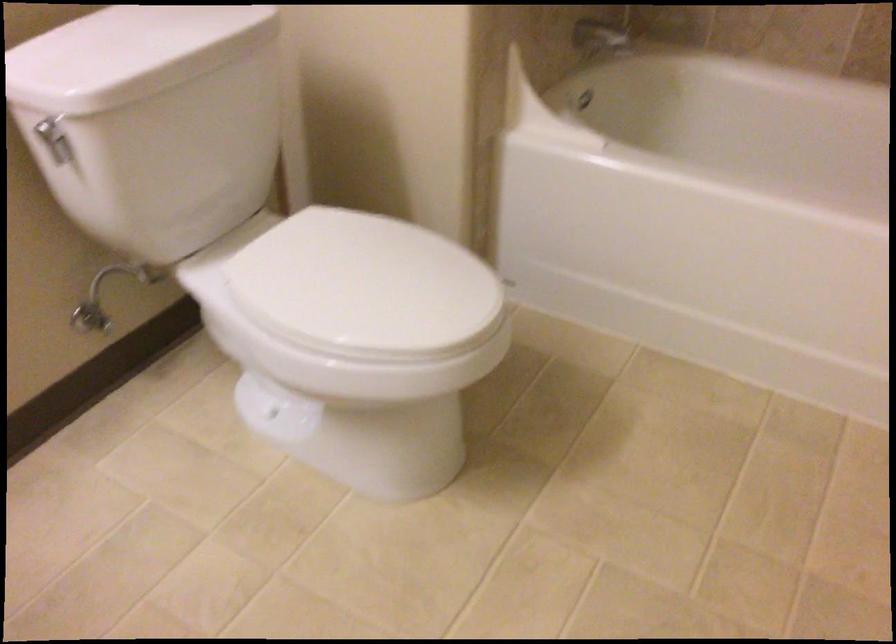
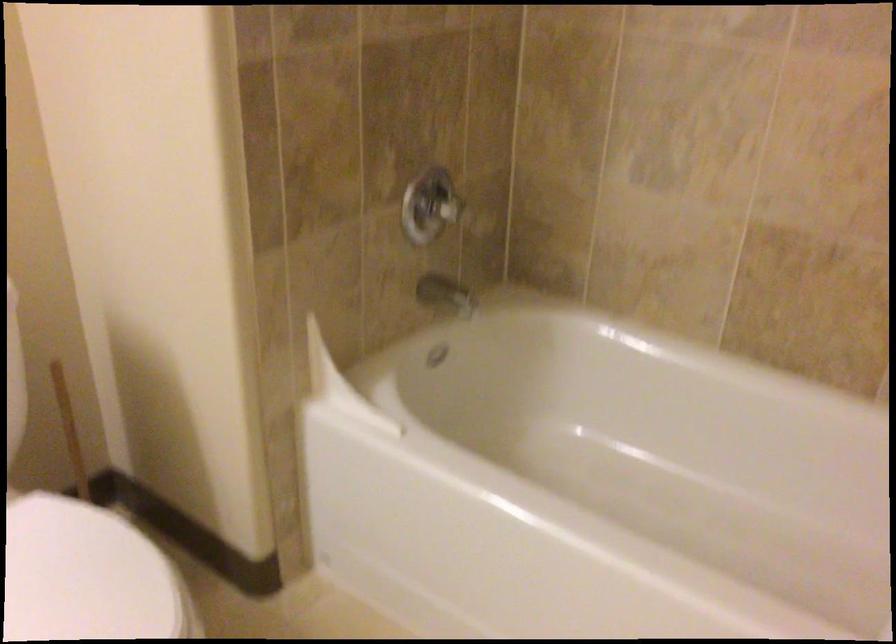
Question: The first image is from the beginning of the video and the second image is from the end. How did the camera likely rotate when shooting the video?

Choices:
 (A) Left
 (B) Right
 (C) Up
 (D) Down

Answer: (C)